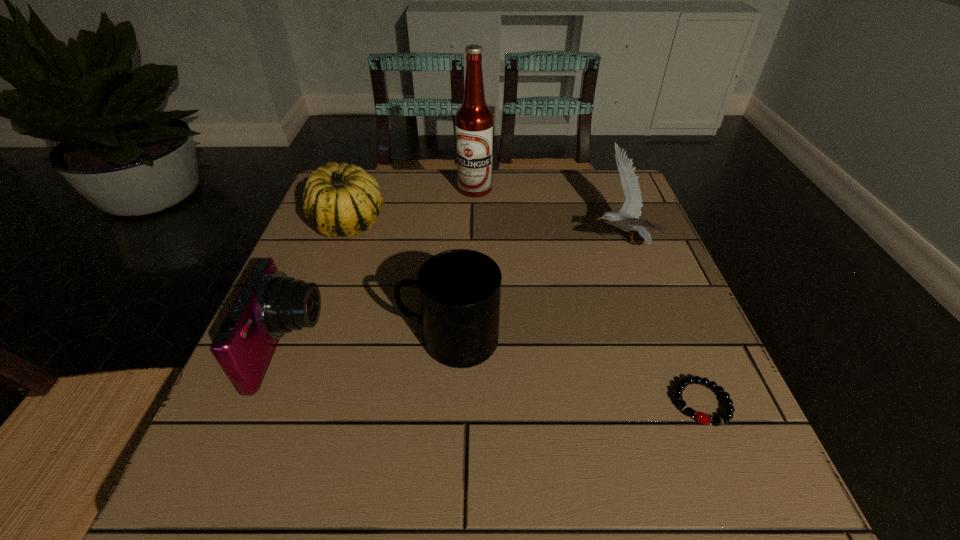
This screenshot has height=540, width=960. Identify the location of empty space between the gourd and the tallest object. (412, 206).

The height and width of the screenshot is (540, 960). What are the coordinates of `unoccupied position between the tallest object and the gull` in the screenshot? It's located at (548, 216).

Identify which object is the fourth closest to the gull. Please provide its 2D coordinates. Your answer should be formatted as a tuple, i.e. [(x, y)], where the tuple contains the x and y coordinates of a point satisfying the conditions above.

[(339, 200)]

Identify the location of object that is the third closest to the gourd. (459, 289).

Where is `free space that satisfies the following two spatial constraints: 1. on the side of the shortest object with the handle; 2. on the right side of the mug`? This screenshot has height=540, width=960. free space that satisfies the following two spatial constraints: 1. on the side of the shortest object with the handle; 2. on the right side of the mug is located at coordinates (446, 403).

You are a GUI agent. You are given a task and a screenshot of the screen. Output one action in this format:
    pyautogui.click(x=<x>, y=<y>)
    Task: Click on the free space in the image that satisfies the following two spatial constraints: 1. on the label side of the tallest object; 2. on the front-facing side of the camera
    
    Given the screenshot: What is the action you would take?
    pyautogui.click(x=472, y=348)

Identify the location of free location that satisfies the following two spatial constraints: 1. on the front-facing side of the camera; 2. on the back side of the shortest object. (267, 403).

The height and width of the screenshot is (540, 960). I want to click on free location that satisfies the following two spatial constraints: 1. on the front side of the gourd; 2. on the front-facing side of the camera, so coord(302,348).